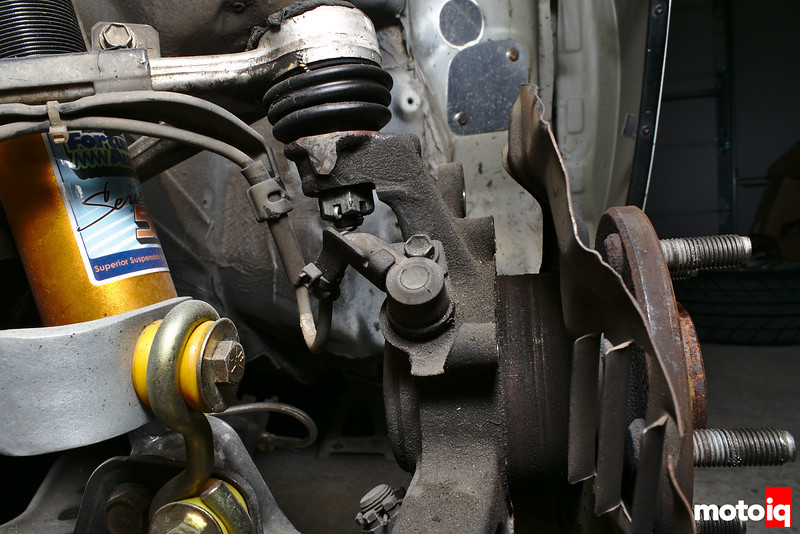
You are a GUI agent. You are given a task and a screenshot of the screen. Output one action in this format:
    pyautogui.click(x=<x>, y=<y>)
    Task: Click on the floor
    This screenshot has height=534, width=800.
    Given the screenshot: What is the action you would take?
    pyautogui.click(x=726, y=480)